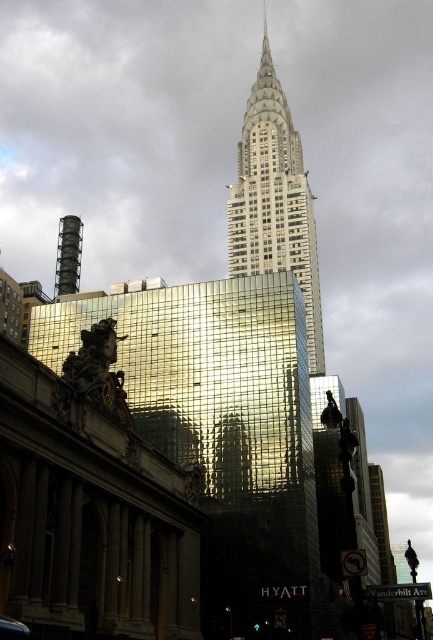
You are a photographer trying to capture the Chrysler Building in the background. However, there are two structures blocking your view. Can you determine if the gold reflective glass building at center or the white marble tower at upper center is closer to you, potentially obstructing your shot?

The gold reflective glass building at center is in front of the white marble tower at upper center, so it is closer and would obstruct the view of the Chrysler Building.

You are an architect evaluating the urban skyline. You observe the gold reflective glass building at center and the white marble tower at upper center. Which structure has a greater height?

The white marble tower at upper center has a greater height than the gold reflective glass building at center.

Based on the coordinates provided, which object in the scene is located at point (222, 429)?

The gold reflective glass building at center is located at point (222, 429).